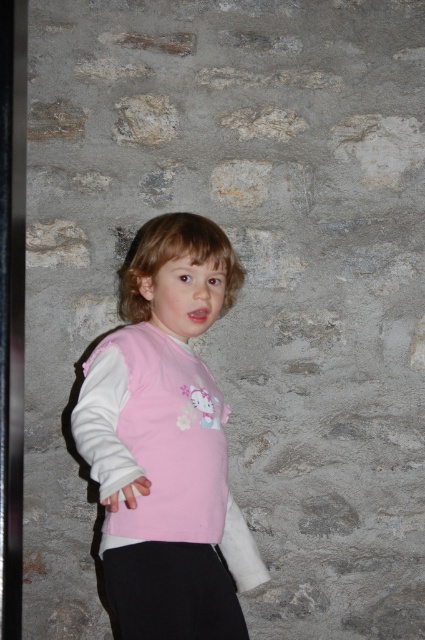
In the scene shown: Between pink fabric shirt at center and black cotton pants at lower center, which one is positioned higher?

pink fabric shirt at center

Can you confirm if pink fabric shirt at center is thinner than black cotton pants at lower center?

Incorrect, pink fabric shirt at center's width is not less than black cotton pants at lower center's.

Is point (95, 438) farther from viewer compared to point (136, 624)?

No, it is in front of (136, 624).

At what (x,y) coordinates should I click in order to perform the action: click on pink fabric shirt at center. Please return your answer as a coordinate pair (x, y). Looking at the image, I should click on (164, 436).